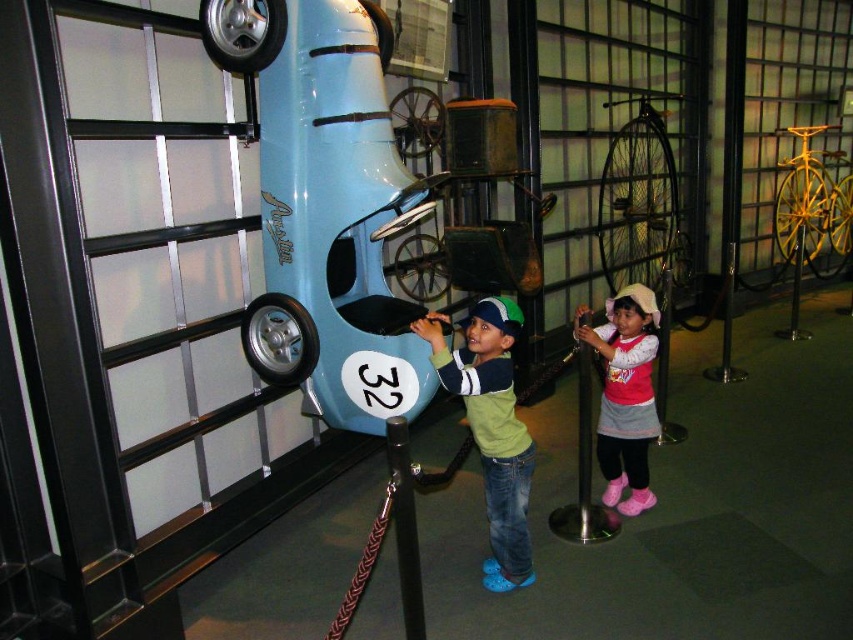
Question: Is the position of green matte shirt at center less distant than that of pink fabric dress at lower right?

Choices:
 (A) yes
 (B) no

Answer: (A)

Question: Which point is farther to the camera?

Choices:
 (A) (526, 550)
 (B) (653, 436)

Answer: (B)

Question: Can you confirm if green matte shirt at center is positioned below pink fabric dress at lower right?

Choices:
 (A) no
 (B) yes

Answer: (B)

Question: Can you confirm if green matte shirt at center is positioned to the right of pink fabric dress at lower right?

Choices:
 (A) no
 (B) yes

Answer: (A)

Question: Which object is closer to the camera taking this photo?

Choices:
 (A) green matte shirt at center
 (B) pink fabric dress at lower right

Answer: (A)

Question: Which of the following is the farthest from the observer?

Choices:
 (A) (494, 592)
 (B) (630, 349)

Answer: (B)